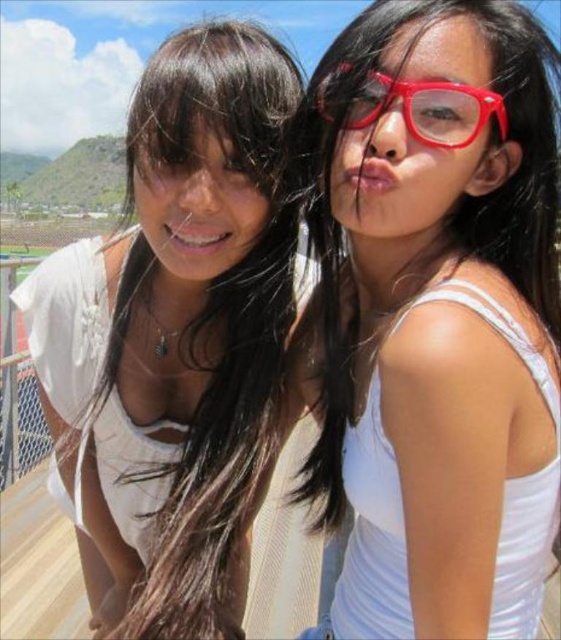
Consider the image. You are a photographer trying to capture a closeup of the shiny plastic glasses at upper right while also ensuring the white matte tank top at left is visible in the frame. Based on their positions, is the glasses likely to be above or below the tank top in the photo?

The white matte tank top at left is located below shiny plastic glasses at upper right, so the glasses will be above the tank top in the photo.

You are taking a photo of two people standing in front of you. The first person is at point (x=393, y=196) and the second person is at point (x=135, y=515). Which person will appear larger in the photo?

The person at point (x=393, y=196) will appear larger because it is closer to the camera than point (x=135, y=515).

You are a photographer trying to focus on the matte white tank top at center. What are the coordinates where you should aim your camera?

The matte white tank top at center is located at coordinates point (430, 305).